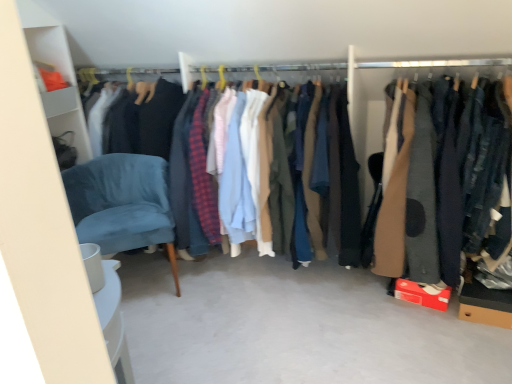
Question: Is brown wool coat at right, acting as the first clothing starting from the right, not inside matte cotton shirts at center, the 2th clothing viewed from the right?

Choices:
 (A) yes
 (B) no

Answer: (A)

Question: Does brown wool coat at right, arranged as the second clothing when viewed from the left, appear on the left side of matte cotton shirts at center, the 2th clothing viewed from the right?

Choices:
 (A) yes
 (B) no

Answer: (B)

Question: Is brown wool coat at right, acting as the first clothing starting from the right, far away from matte cotton shirts at center, the 2th clothing viewed from the right?

Choices:
 (A) yes
 (B) no

Answer: (B)

Question: Can you confirm if brown wool coat at right, acting as the first clothing starting from the right, is taller than matte cotton shirts at center, which appears as the first clothing when viewed from the left?

Choices:
 (A) yes
 (B) no

Answer: (B)

Question: Could you tell me if brown wool coat at right, acting as the first clothing starting from the right, is turned towards matte cotton shirts at center, the 2th clothing viewed from the right?

Choices:
 (A) no
 (B) yes

Answer: (A)

Question: From a real-world perspective, is brown wool coat at right, arranged as the second clothing when viewed from the left, below matte cotton shirts at center, the 2th clothing viewed from the right?

Choices:
 (A) no
 (B) yes

Answer: (A)

Question: From the image's perspective, is brown wool coat at right, acting as the first clothing starting from the right, beneath velvet blue chair at lower left?

Choices:
 (A) no
 (B) yes

Answer: (A)

Question: Could you tell me if brown wool coat at right, acting as the first clothing starting from the right, is turned towards velvet blue chair at lower left?

Choices:
 (A) no
 (B) yes

Answer: (A)

Question: Are brown wool coat at right, arranged as the second clothing when viewed from the left, and velvet blue chair at lower left making contact?

Choices:
 (A) no
 (B) yes

Answer: (A)

Question: Is velvet blue chair at lower left at the back of brown wool coat at right, arranged as the second clothing when viewed from the left?

Choices:
 (A) yes
 (B) no

Answer: (B)

Question: Does brown wool coat at right, arranged as the second clothing when viewed from the left, lie behind velvet blue chair at lower left?

Choices:
 (A) no
 (B) yes

Answer: (A)

Question: Is brown wool coat at right, arranged as the second clothing when viewed from the left, positioned beyond the bounds of velvet blue chair at lower left?

Choices:
 (A) yes
 (B) no

Answer: (A)

Question: Does matte cotton shirts at center, which appears as the first clothing when viewed from the left, have a greater width compared to brown wool coat at right, arranged as the second clothing when viewed from the left?

Choices:
 (A) no
 (B) yes

Answer: (A)